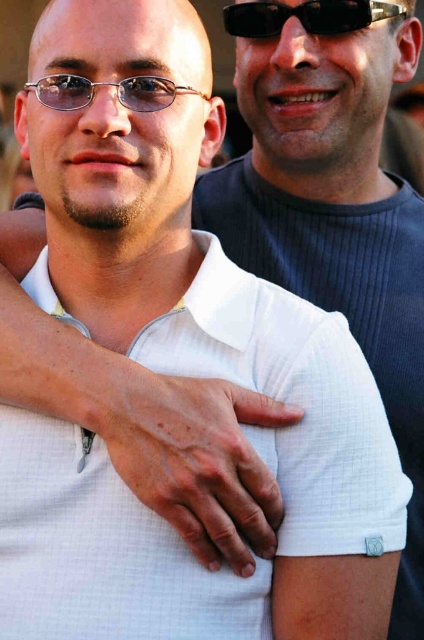
From the picture: You are standing in front of a photo of two people. The person in the front is wearing a white mesh shirt at center. If you want to see the person behind them more clearly, should you move closer to or farther away from the photo?

To see the person behind the white mesh shirt at center more clearly, you should move closer to the photo. Since the white mesh shirt at center is only 4.78 feet away from the viewer, moving closer will reduce the distance, allowing a clearer view of the person behind.

You are designing a layout for a photo album page. You need to place a photo of the white mesh shirt at center and the matte metal glasses at center side by side. Which object should be placed first if you want the wider object to be on the left side?

The white mesh shirt at center should be placed first on the left side because it is wider than the matte metal glasses at center.

You are a photographer trying to adjust the focus of your camera. You want to ensure both the black plastic sunglasses at upper center and the matte metal glasses at center are clearly visible. Based on their positions, which object should you focus on first to capture both in sharp detail?

The black plastic sunglasses at upper center is above matte metal glasses at center. To capture both in sharp detail, focus on the matte metal glasses at center first since it is closer to the camera, and the black plastic sunglasses at upper center will also be in focus due to their proximity.